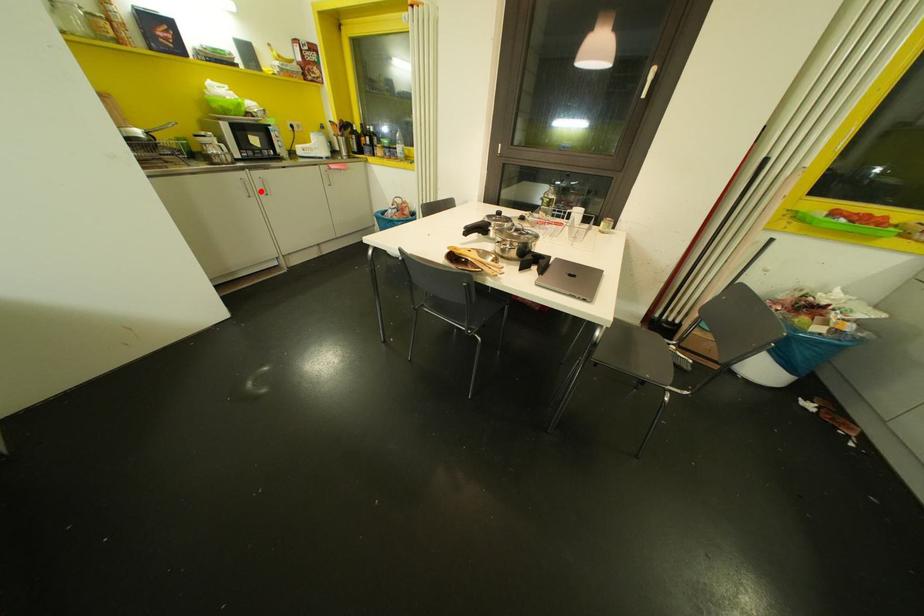
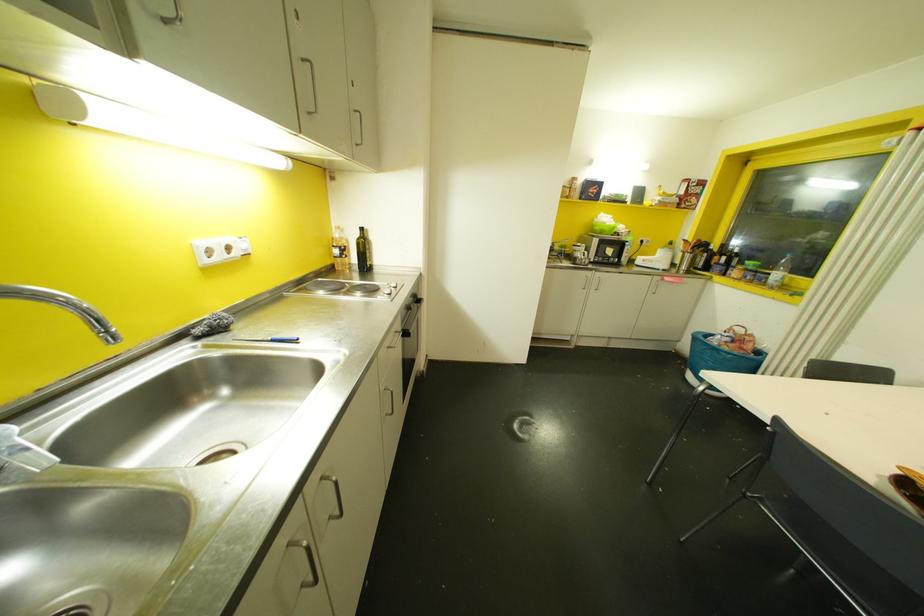
Find the pixel in the second image that matches the highlighted location in the first image.

(592, 286)